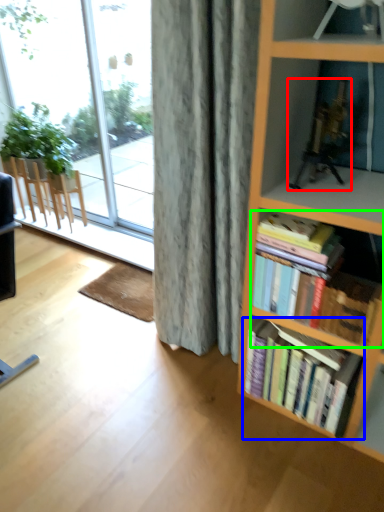
Question: Considering the real-world distances, which object is farthest from toy (highlighted by a red box)? book (highlighted by a blue box) or book (highlighted by a green box)?

Choices:
 (A) book
 (B) book

Answer: (A)